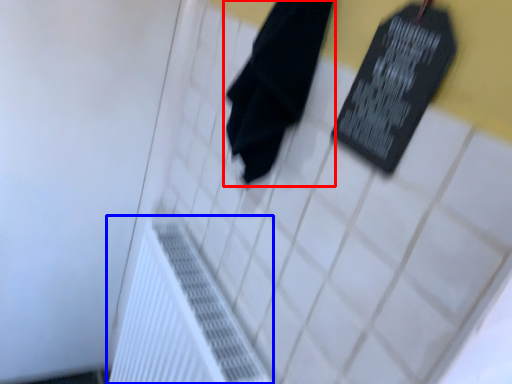
Question: Among these objects, which one is farthest to the camera, towel (highlighted by a red box) or radiator (highlighted by a blue box)?

Choices:
 (A) towel
 (B) radiator

Answer: (B)